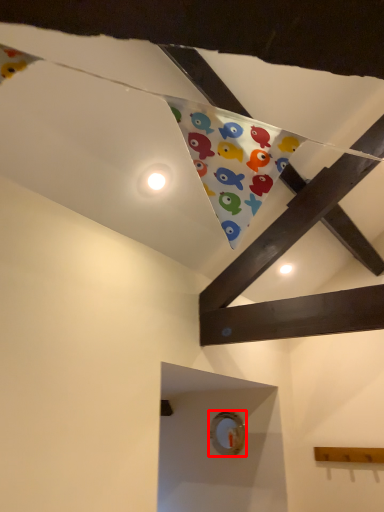
Question: In this image, where is button (annotated by the red box) located relative to button?

Choices:
 (A) left
 (B) right

Answer: (B)